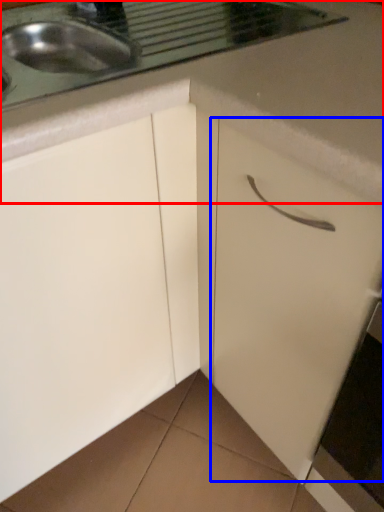
Question: Among these objects, which one is nearest to the camera, countertop (highlighted by a red box) or drawer (highlighted by a blue box)?

Choices:
 (A) countertop
 (B) drawer

Answer: (B)